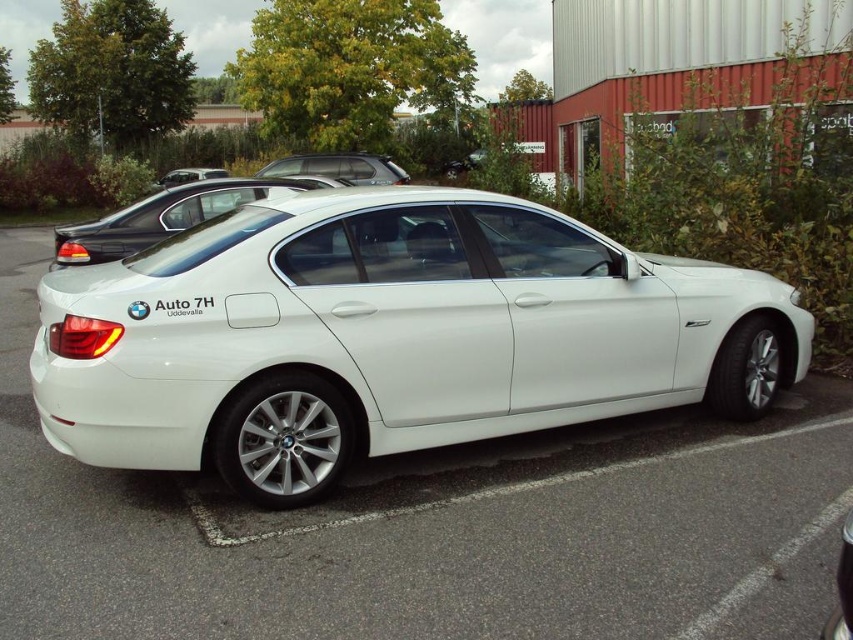
From the picture: Who is shorter, satin silver suv at upper center or matte black car at upper center?

Standing shorter between the two is satin silver suv at upper center.

Locate an element on the screen. satin silver suv at upper center is located at coordinates (339, 168).

Find the location of a particular element. The width and height of the screenshot is (853, 640). satin silver suv at upper center is located at coordinates [x=339, y=168].

Is white metallic car at center taller than white glossy sedan at center?

Indeed, white metallic car at center has a greater height compared to white glossy sedan at center.

Is the position of white metallic car at center more distant than that of white glossy sedan at center?

No, white metallic car at center is in front of white glossy sedan at center.

Is point (315, 422) positioned before point (132, 240)?

Yes, it is.

What are the coordinates of `white metallic car at center` in the screenshot? It's located at (389, 337).

Which is more to the right, white metallic car at center or matte black car at upper center?

white metallic car at center

Does white metallic car at center appear on the right side of matte black car at upper center?

Correct, you'll find white metallic car at center to the right of matte black car at upper center.

What are the coordinates of `white metallic car at center` in the screenshot? It's located at (389, 337).

Where is `white metallic car at center`? The height and width of the screenshot is (640, 853). white metallic car at center is located at coordinates (389, 337).